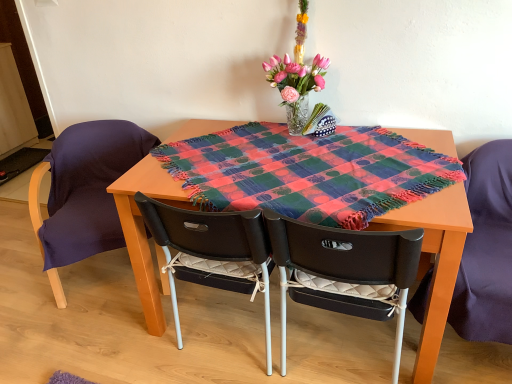
Question: From their relative heights in the image, would you say black quilted cushion at center, which is the 3th chair in left-to-right order, is taller or shorter than purple fabric chair at left, placed as the 1th chair when sorted from left to right?

Choices:
 (A) tall
 (B) short

Answer: (B)

Question: In the image, is black quilted cushion at center, the second chair positioned from the right, positioned in front of or behind purple fabric chair at left, placed as the 1th chair when sorted from left to right?

Choices:
 (A) behind
 (B) front

Answer: (B)

Question: Which of these objects is positioned farthest from the purple fabric chair at left, which appears as the 4th chair when viewed from the right?

Choices:
 (A) black plastic chair with white cushion at center, the third chair positioned from the right
 (B) matte black chair at right, positioned as the 4th chair in left-to-right order
 (C) black quilted cushion at center, which is the 3th chair in left-to-right order
 (D) pink glass vase at upper center
 (E) multicolored woven blanket at center

Answer: (B)

Question: Which object is positioned closest to the black quilted cushion at center, the second chair positioned from the right?

Choices:
 (A) purple fabric chair at left, placed as the 1th chair when sorted from left to right
 (B) black plastic chair with white cushion at center, the third chair positioned from the right
 (C) multicolored woven blanket at center
 (D) matte black chair at right, positioned as the 4th chair in left-to-right order
 (E) pink glass vase at upper center

Answer: (B)